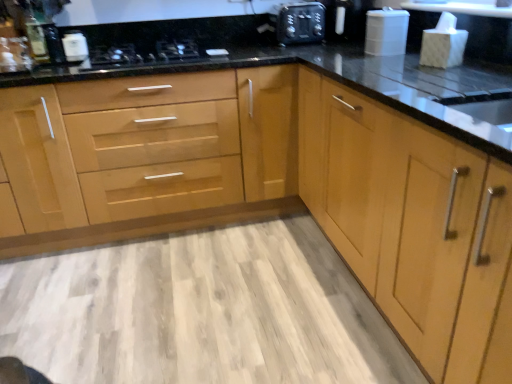
Question: Looking at the image, does matte silver faucet at upper left seem bigger or smaller compared to light wood cabinet at right, which appears as the 2th cabinetry when viewed from the left?

Choices:
 (A) big
 (B) small

Answer: (B)

Question: From a real-world perspective, relative to light wood cabinet at right, which appears as the 2th cabinetry when viewed from the left, is matte silver faucet at upper left vertically above or below?

Choices:
 (A) below
 (B) above

Answer: (B)

Question: Which object is positioned farthest from the black glass stove at upper center?

Choices:
 (A) matte silver faucet at upper left
 (B) light wood cabinet at right, the first cabinetry viewed from the right
 (C) matte black sink at right
 (D) light wood cabinet at center, which ranks as the second cabinetry in right-to-left order
 (E) white glossy container at upper left, arranged as the 1th appliance when viewed from the left

Answer: (C)

Question: Based on their relative distances, which object is nearer to the light wood cabinet at center, arranged as the first cabinetry when viewed from the left?

Choices:
 (A) black plastic camera at upper center, acting as the second appliance starting from the left
 (B) black glass stove at upper center
 (C) light wood cabinet at right, which appears as the 2th cabinetry when viewed from the left
 (D) white glossy container at upper left, arranged as the 1th appliance when viewed from the left
 (E) matte black sink at right

Answer: (B)